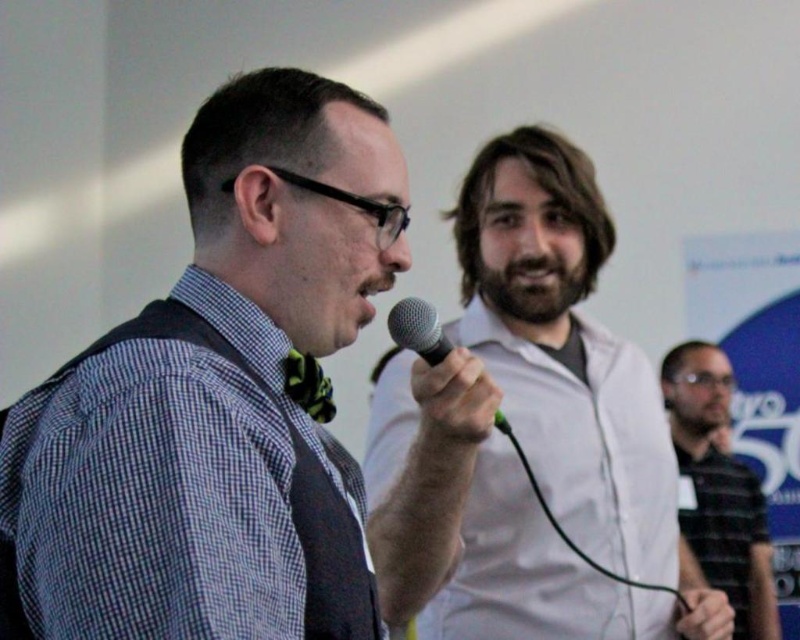
From the picture: You are standing in the room and want to see both the checkered fabric shirt at center and the white matte shirt at center clearly. Which one is positioned higher in the image?

The checkered fabric shirt at center is located above the white matte shirt at center, so it is positioned higher.

You are standing in the room and want to move from point A at point [462,564] to point B at point [501,416]. Since point A is closer to you, would you need to walk forward or backward to reach point B?

Point A at point [462,564] is closer to you than point B at point [501,416]. To reach point B, you would need to walk backward away from point A.

You are organizing an event and need to ensure that the black metallic microphone at center is visible to the audience. Given the current setup, will the white matte shirt at center block the microphone from being seen?

The white matte shirt at center is bigger than the black metallic microphone at center, so it may block the microphone from being seen by the audience.